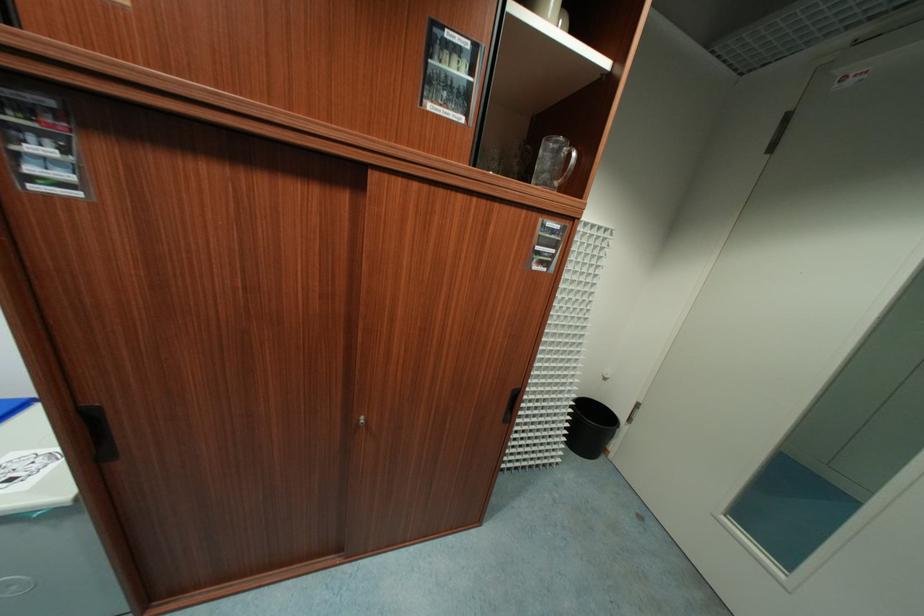
This screenshot has width=924, height=616. Describe the element at coordinates (568, 163) in the screenshot. I see `the glass mug handle` at that location.